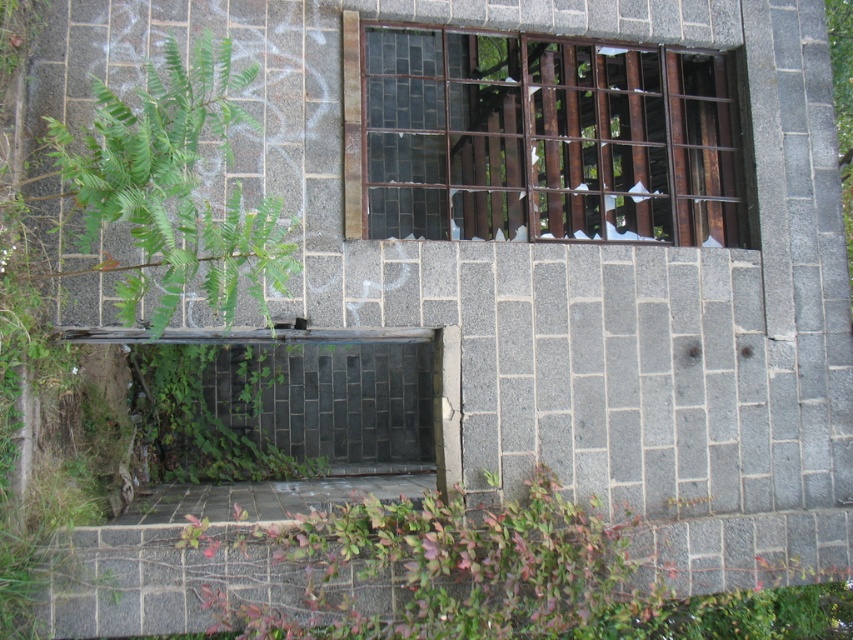
Question: Where is green leafy plant at lower center located in relation to green leafy plant at left in the image?

Choices:
 (A) above
 (B) below

Answer: (B)

Question: Which object is positioned closest to the green leafy plant at lower center?

Choices:
 (A) green leafy plant at left
 (B) rusty metal bars at upper center

Answer: (A)

Question: Is the position of rusty metal bars at upper center more distant than that of green leafy plant at lower center?

Choices:
 (A) no
 (B) yes

Answer: (B)

Question: Considering the relative positions of green leafy plant at lower center and green leafy plant at left in the image provided, where is green leafy plant at lower center located with respect to green leafy plant at left?

Choices:
 (A) left
 (B) right

Answer: (B)

Question: Among these points, which one is farthest from the camera?

Choices:
 (A) (427, 616)
 (B) (624, 68)

Answer: (B)

Question: Which point appears closest to the camera in this image?

Choices:
 (A) (438, 572)
 (B) (177, 294)

Answer: (B)